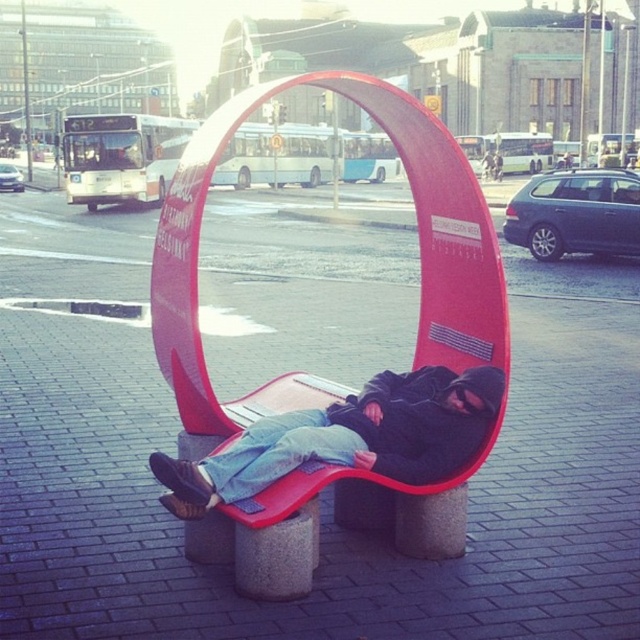
Question: Which point appears farthest from the camera in this image?

Choices:
 (A) (413, 104)
 (B) (433, 378)

Answer: (B)

Question: Does matte plastic bench at center appear over denim jacket at center?

Choices:
 (A) no
 (B) yes

Answer: (B)

Question: Which of the following is the closest to the observer?

Choices:
 (A) matte plastic bench at center
 (B) denim jacket at center

Answer: (B)

Question: Considering the relative positions of matte plastic bench at center and denim jacket at center in the image provided, where is matte plastic bench at center located with respect to denim jacket at center?

Choices:
 (A) right
 (B) left

Answer: (A)

Question: Can you confirm if matte plastic bench at center is wider than denim jacket at center?

Choices:
 (A) no
 (B) yes

Answer: (B)

Question: Which point is farther to the camera?

Choices:
 (A) (205, 388)
 (B) (451, 384)

Answer: (B)